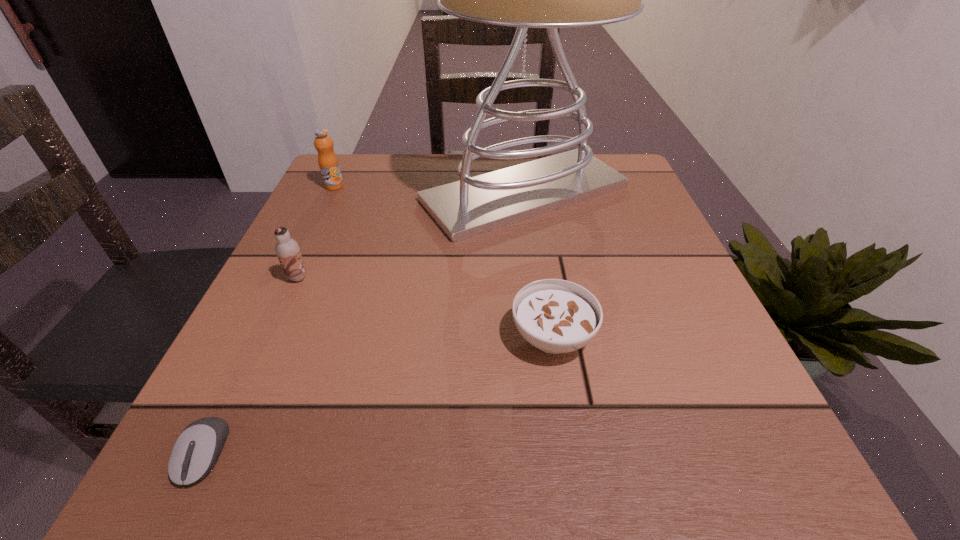
Find the location of a particular element. The height and width of the screenshot is (540, 960). vacant space that satisfies the following two spatial constraints: 1. on the front label of the third tallest object; 2. on the right side of the orange juice is located at coordinates (291, 278).

Identify the location of free space that satisfies the following two spatial constraints: 1. on the front label of the tallest object; 2. on the right side of the fourth shortest object. The image size is (960, 540). (331, 193).